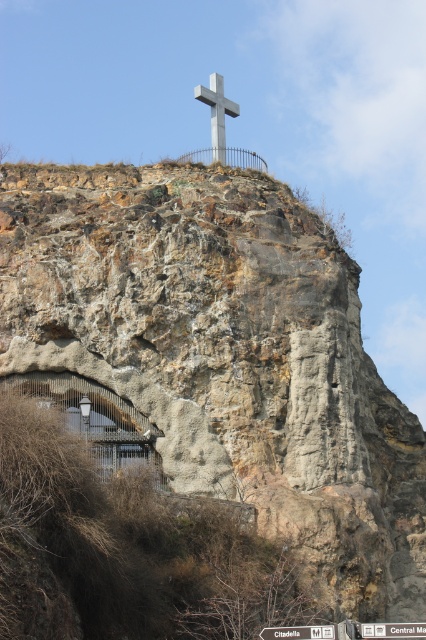
You are a hiker who needs to choose between two markers to place a small flag on. The markers are the white plastic signpost at upper center and the white plastic street sign at upper center. Which marker has a narrower width, making it suitable for placing the flag without blocking its visibility?

The white plastic signpost at upper center has a lesser width compared to the white plastic street sign at upper center, so it is narrower and suitable for placing the flag without blocking its visibility.

You are standing at the base of the hill looking up. There is a metallic cross at upper center and a white plastic signpost at upper center. Which object is closer to you?

The metallic cross at upper center is closer to you because it is further to the viewer than the white plastic signpost at upper center.